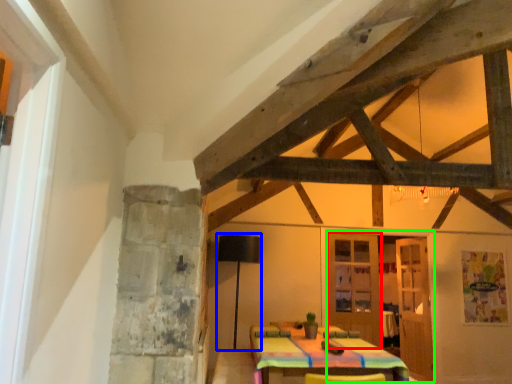
Question: Which is nearer to the door (highlighted by a red box)? lamp (highlighted by a blue box) or door (highlighted by a green box).

Choices:
 (A) lamp
 (B) door

Answer: (B)